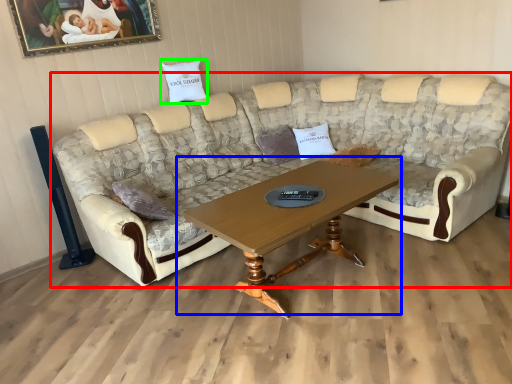
Question: Which is nearer to the studio couch (highlighted by a red box)? coffee table (highlighted by a blue box) or pillow (highlighted by a green box).

Choices:
 (A) coffee table
 (B) pillow

Answer: (A)